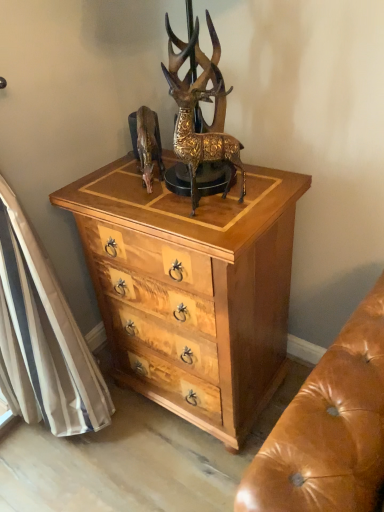
Where is `vacant space positioned to the left of gold textured deer at center`? The image size is (384, 512). vacant space positioned to the left of gold textured deer at center is located at coordinates [x=153, y=208].